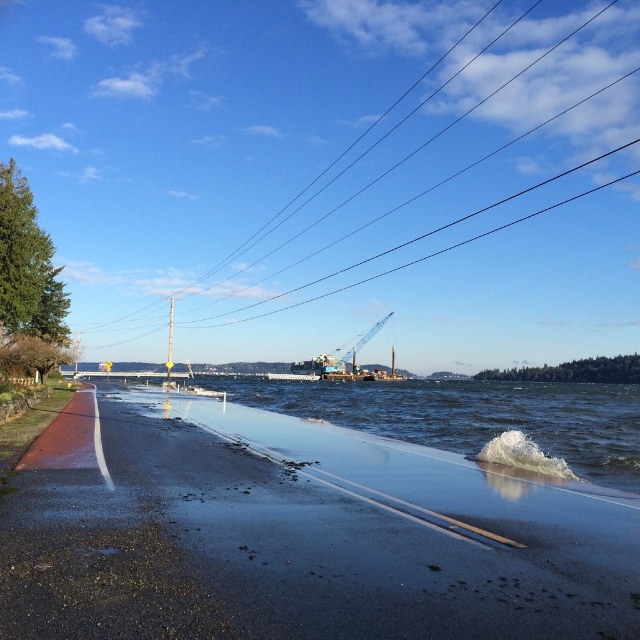
Describe the element at coordinates (296, 532) in the screenshot. I see `shiny asphalt road at lower left` at that location.

Is point (580, 496) more distant than point (378, 324)?

No.

The height and width of the screenshot is (640, 640). I want to click on shiny asphalt road at lower left, so click(296, 532).

In the scene shown: Can you confirm if black wire at upper center is positioned below shiny asphalt road at lower left?

Incorrect, black wire at upper center is not positioned below shiny asphalt road at lower left.

Does black wire at upper center have a lesser height compared to shiny asphalt road at lower left?

Incorrect, black wire at upper center's height does not fall short of shiny asphalt road at lower left's.

Between point (264, 237) and point (300, 512), which one is positioned in front?

Point (300, 512) is more forward.

This screenshot has height=640, width=640. I want to click on black wire at upper center, so point(339,177).

Which is below, black wire at upper center or metallic blue crane at center?

metallic blue crane at center

Is point (228, 216) less distant than point (371, 337)?

That is False.

What do you see at coordinates (339, 177) in the screenshot?
I see `black wire at upper center` at bounding box center [339, 177].

Where is `black wire at upper center`? The width and height of the screenshot is (640, 640). black wire at upper center is located at coordinates (339, 177).